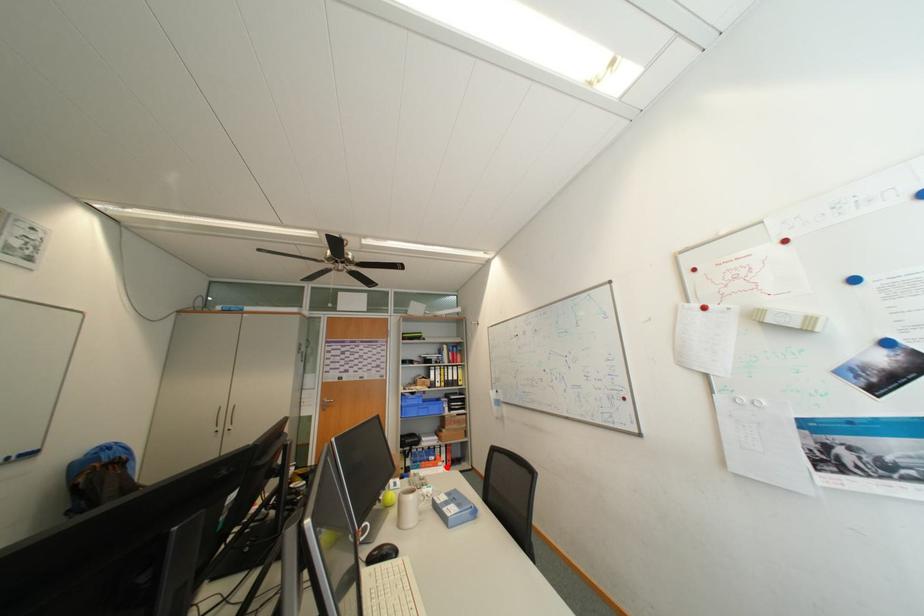
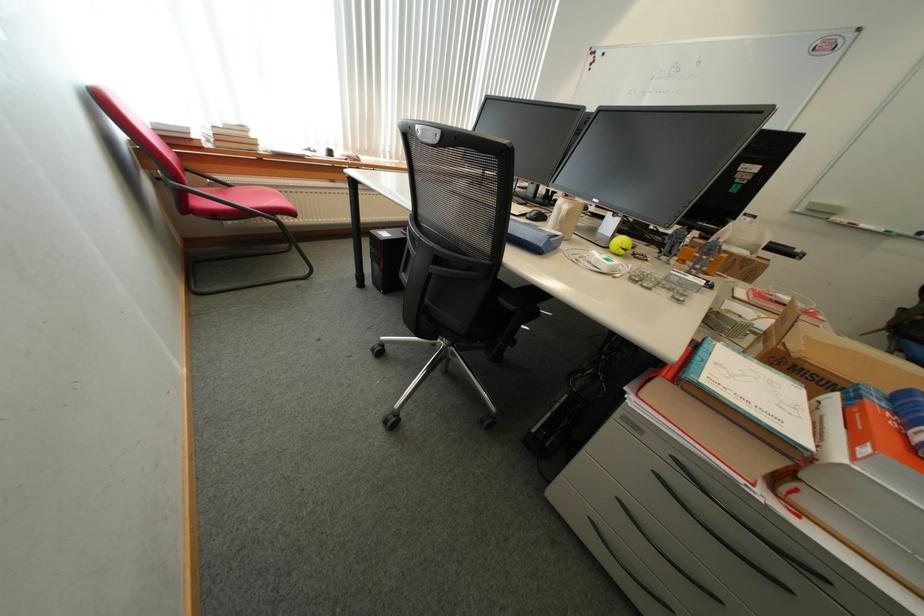
In the second image, find the point that corresponds to the highlighted location in the first image.

(864, 446)